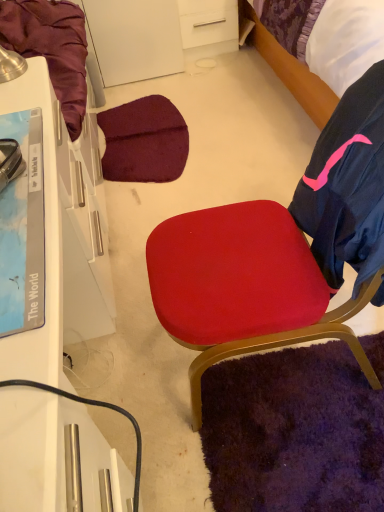
Describe the element at coordinates (50, 312) in the screenshot. I see `white glossy desk at left` at that location.

Locate an element on the screen. The height and width of the screenshot is (512, 384). matte red cushion at center is located at coordinates (279, 252).

Looking at this image, does purple fabric bed at upper right have a lesser height compared to matte red cushion at center?

Correct, purple fabric bed at upper right is not as tall as matte red cushion at center.

Is purple fabric bed at upper right next to matte red cushion at center?

purple fabric bed at upper right and matte red cushion at center are clearly separated.

Could you tell me if purple fabric bed at upper right is turned towards matte red cushion at center?

No, purple fabric bed at upper right is not oriented towards matte red cushion at center.

From the image's perspective, is purple fabric bed at upper right positioned above or below matte red cushion at center?

purple fabric bed at upper right is situated higher than matte red cushion at center in the image.

Considering the sizes of objects matte red cushion at center and white glossy desk at left in the image provided, who is taller, matte red cushion at center or white glossy desk at left?

matte red cushion at center.

Is matte red cushion at center turned away from white glossy desk at left?

No, white glossy desk at left is not at the back of matte red cushion at center.

Looking at this image, considering the sizes of objects matte red cushion at center and white glossy desk at left in the image provided, who is smaller, matte red cushion at center or white glossy desk at left?

matte red cushion at center is smaller.

Is there a large distance between matte red cushion at center and white glossy desk at left?

No, there isn't a large distance between matte red cushion at center and white glossy desk at left.

What's the angular difference between white glossy desk at left and purple fabric bed at upper right's facing directions?

They differ by 90 degrees in their facing directions.

Is white glossy desk at left positioned before purple fabric bed at upper right?

Yes.

From a real-world perspective, is white glossy desk at left beneath purple fabric bed at upper right?

No, from a real-world perspective, white glossy desk at left is not under purple fabric bed at upper right.

Is white glossy desk at left to the right of purple fabric bed at upper right from the viewer's perspective?

In fact, white glossy desk at left is to the left of purple fabric bed at upper right.

Can you tell me how much white glossy desk at left and matte red cushion at center differ in facing direction?

They differ by 178 degrees in their facing directions.

Is white glossy desk at left wider than matte red cushion at center?

No.

Is white glossy desk at left not close to matte red cushion at center?

No, there isn't a large distance between white glossy desk at left and matte red cushion at center.

Is matte red cushion at center at the back of white glossy desk at left?

Yes, matte red cushion at center is at the back of white glossy desk at left.

Locate an element on the screen. The width and height of the screenshot is (384, 512). chair on the left of purple fabric bed at upper right is located at coordinates (279, 252).

Is matte red cushion at center smaller than purple fabric bed at upper right?

Indeed, matte red cushion at center has a smaller size compared to purple fabric bed at upper right.

Looking at this image, can you confirm if matte red cushion at center is thinner than purple fabric bed at upper right?

Yes, matte red cushion at center is thinner than purple fabric bed at upper right.

Can you confirm if purple fabric bed at upper right is taller than white glossy desk at left?

No.

Considering the positions of point (318, 87) and point (43, 162), is point (318, 87) closer or farther from the camera than point (43, 162)?

Point (318, 87) appears to be farther away from the viewer than point (43, 162).

Based on their positions, is purple fabric bed at upper right located to the left or right of white glossy desk at left?

Clearly, purple fabric bed at upper right is on the right of white glossy desk at left in the image.

How different are the orientations of purple fabric bed at upper right and white glossy desk at left in degrees?

There is a 90-degree angle between the facing directions of purple fabric bed at upper right and white glossy desk at left.

Locate an element on the screen. The width and height of the screenshot is (384, 512). bed that is above the matte red cushion at center (from the image's perspective) is located at coordinates (291, 71).

Identify the location of chair lying behind the white glossy desk at left. (279, 252).

Based on their spatial positions, is matte red cushion at center or white glossy desk at left closer to purple fabric bed at upper right?

matte red cushion at center is closer to purple fabric bed at upper right.

From the image, which object appears to be nearer to white glossy desk at left, purple fabric bed at upper right or matte red cushion at center?

matte red cushion at center lies closer to white glossy desk at left than the other object.

Considering their positions, is white glossy desk at left positioned further to purple fabric bed at upper right than matte red cushion at center?

white glossy desk at left lies further to purple fabric bed at upper right than the other object.

Looking at this image, which object lies further to the anchor point matte red cushion at center, white glossy desk at left or purple fabric bed at upper right?

Based on the image, purple fabric bed at upper right appears to be further to matte red cushion at center.

Based on their spatial positions, is purple fabric bed at upper right or white glossy desk at left further from matte red cushion at center?

Based on the image, purple fabric bed at upper right appears to be further to matte red cushion at center.

From the image, which object appears to be nearer to white glossy desk at left, matte red cushion at center or purple fabric bed at upper right?

matte red cushion at center.

The height and width of the screenshot is (512, 384). What are the coordinates of `chair between purple fabric bed at upper right and white glossy desk at left in the up-down direction` in the screenshot? It's located at (279, 252).